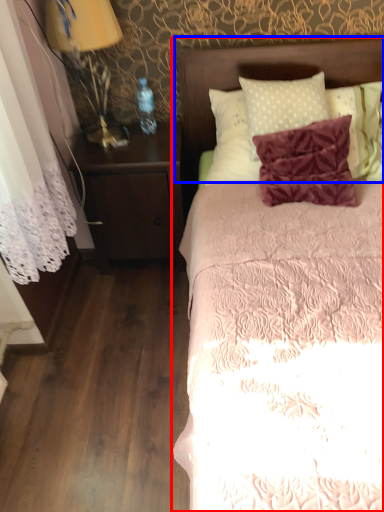
Question: Which object appears farthest to the camera in this image, bed (highlighted by a red box) or headboard (highlighted by a blue box)?

Choices:
 (A) bed
 (B) headboard

Answer: (B)